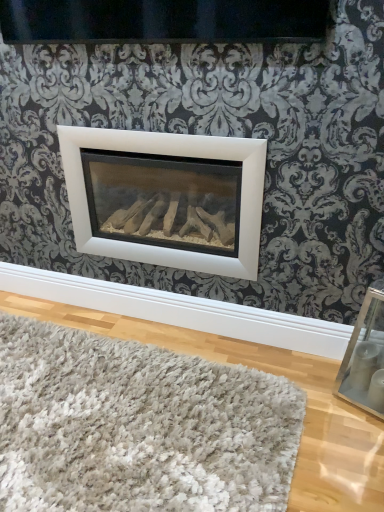
Where is `free space in front of clear glass picture frame at lower right`? This screenshot has width=384, height=512. free space in front of clear glass picture frame at lower right is located at coordinates (355, 445).